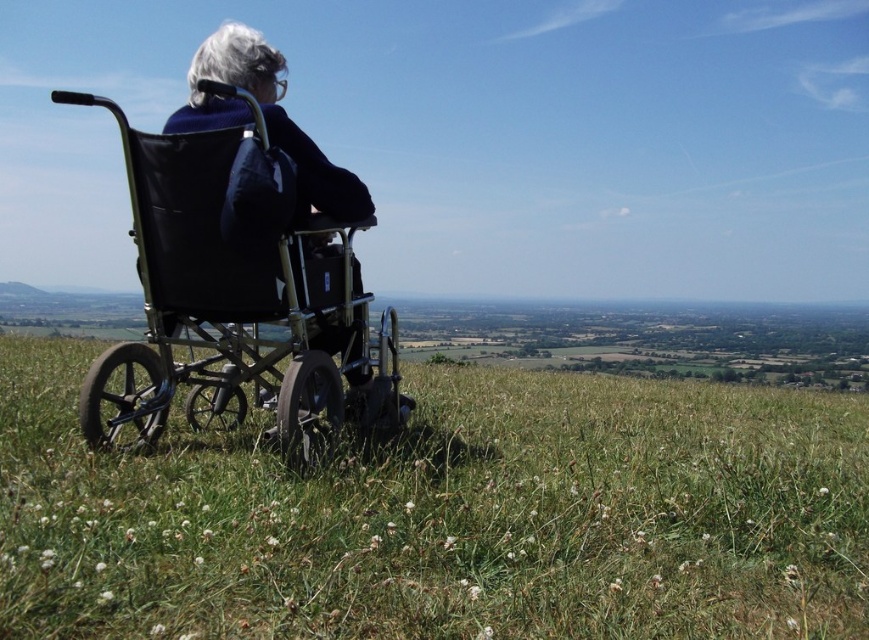
You are standing at the point marked as point (233, 307) in the image. What object is located exactly at this point?

The metallic black wheelchair at left is located exactly at point (233, 307).

You are an outdoor enthusiast planning to set up a small tent in the green grassy field at center. Considering the size of the black fabric wheelchair at center, will there be enough space to place the tent without overlapping the wheelchair?

The green grassy field at center is smaller than the black fabric wheelchair at center, so there might not be enough space to place the tent without overlapping the wheelchair.